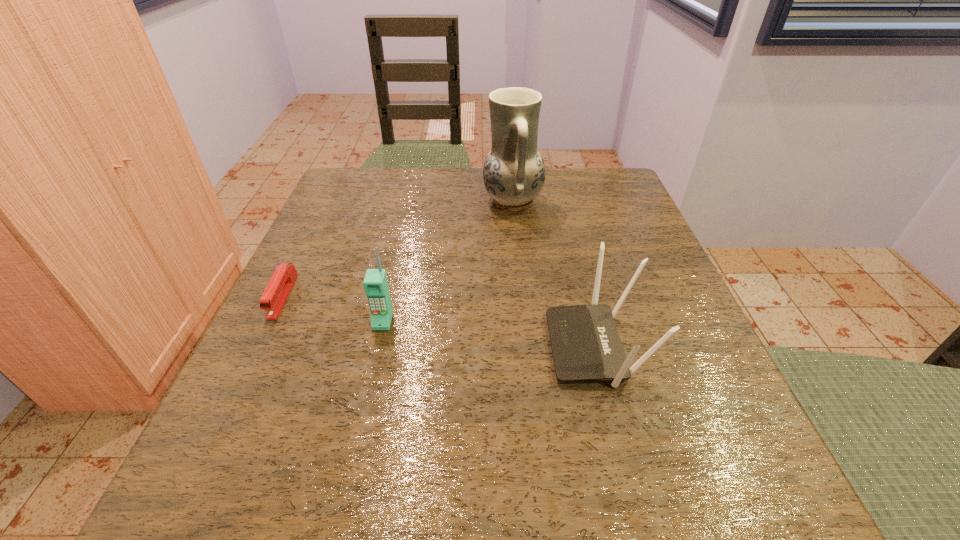
At what (x,y) coordinates should I click in order to perform the action: click on object that stands as the closest to the tallest object. Please return your answer as a coordinate pair (x, y). The image size is (960, 540). Looking at the image, I should click on (585, 343).

What are the coordinates of `the second closest object to the tallest object` in the screenshot? It's located at (375, 283).